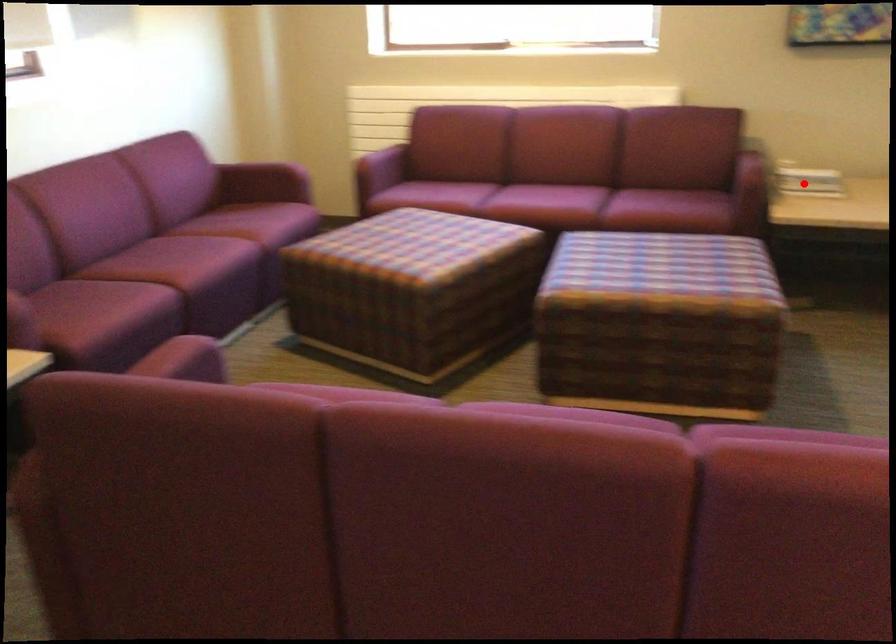
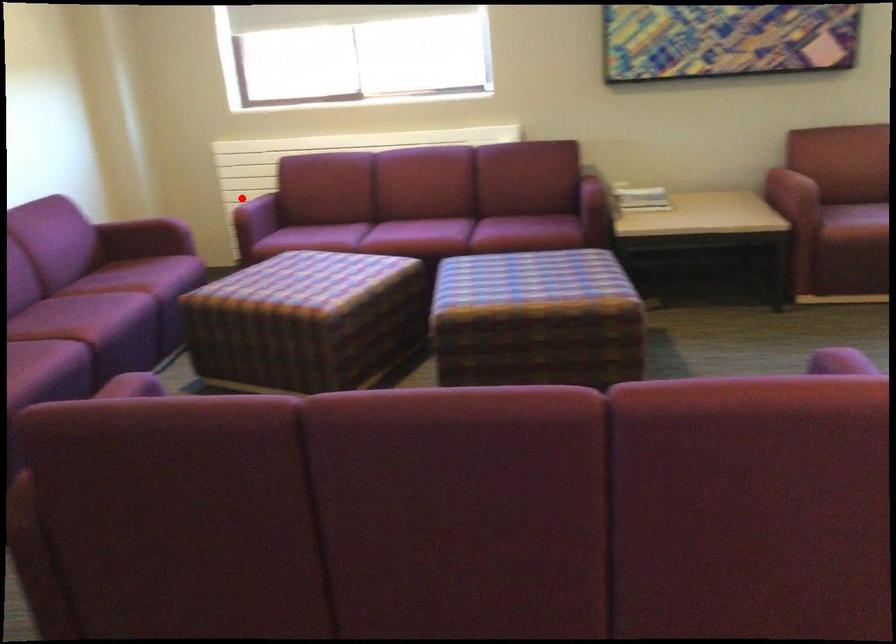
I am providing you with two images of the same scene from different viewpoints. A red point is marked on the first image and another point is marked on the second image. Does the point marked in image1 correspond to the same location as the one in image2?

No